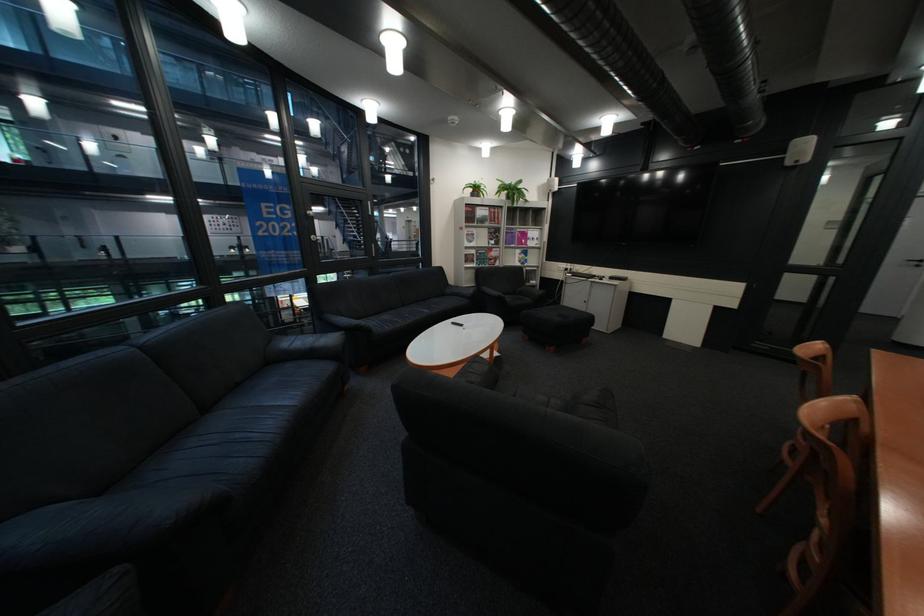
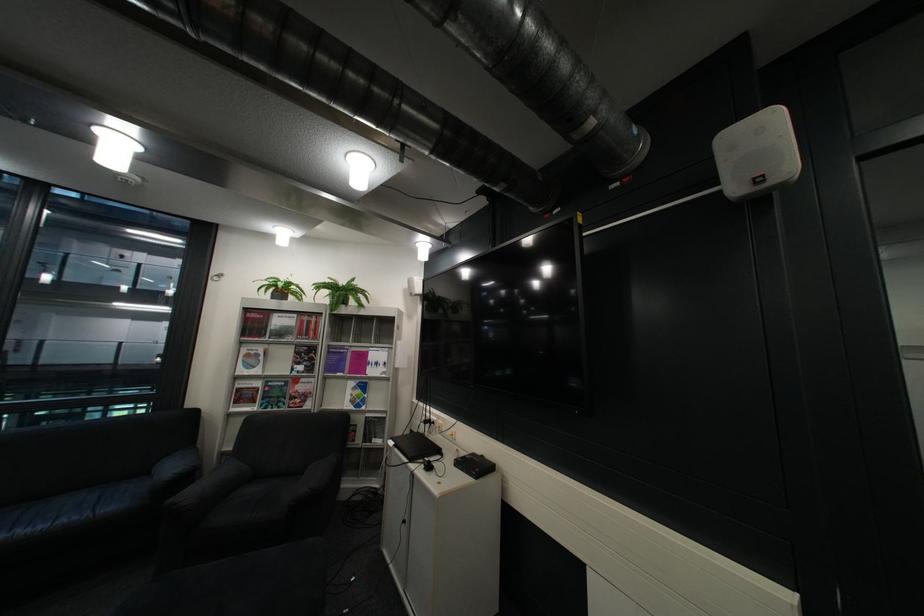
In the second image, find the point that corresponds to (487,190) in the first image.

(287, 290)